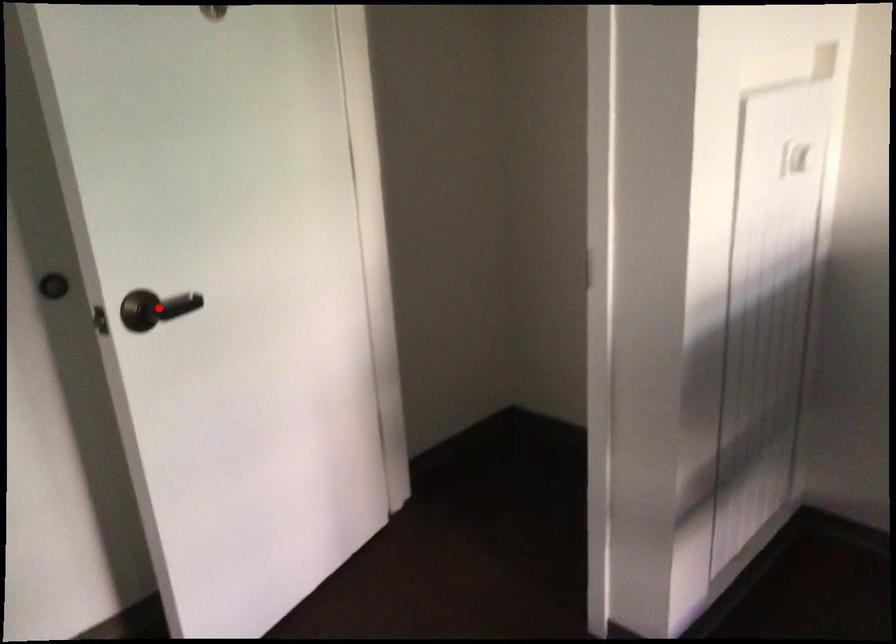
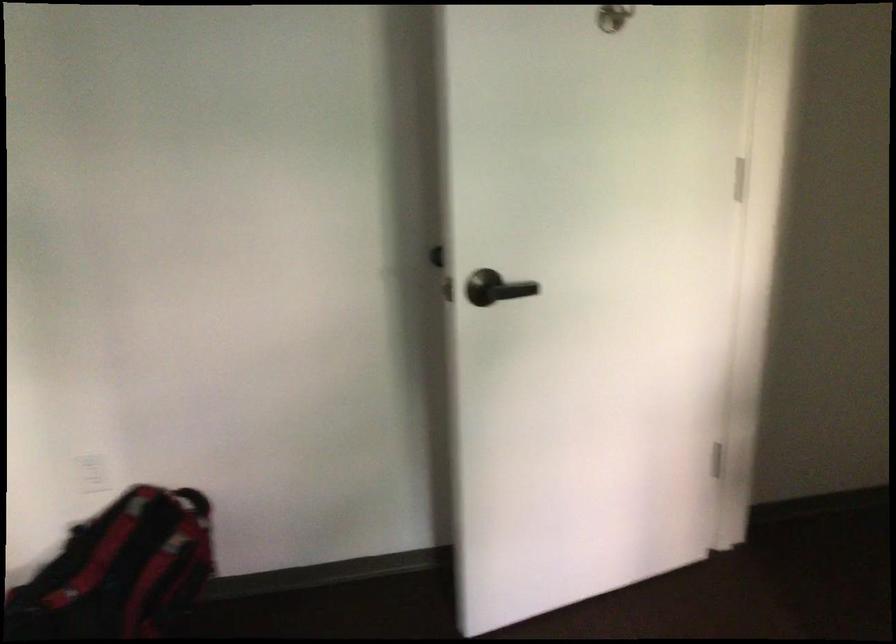
Question: I am providing you with two images of the same scene from different viewpoints. A red point is shown in image1. For the corresponding object point in image2, is it positioned nearer or farther from the camera?

Choices:
 (A) Nearer
 (B) Farther

Answer: (B)